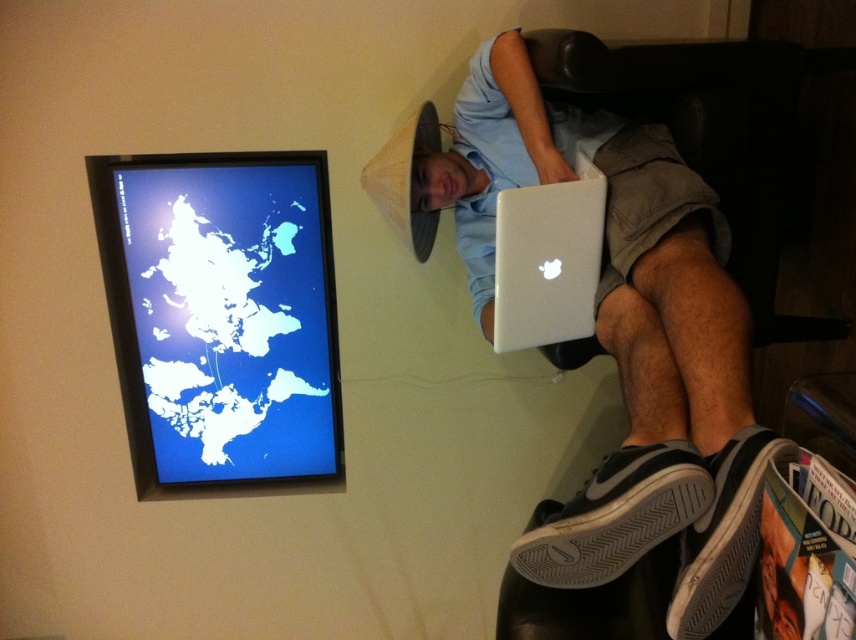
You are a delivery person who needs to place a package on the silver metallic laptop at upper center. However, the package is as big as the black mesh shoe at lower right. Can you place the package on the laptop without moving the laptop or the shoe?

The silver metallic laptop at upper center is positioned over the black mesh shoe at lower right, meaning the laptop is already above the shoe. Since the package is as big as the shoe, placing it on the laptop would require space not obstructed by the shoe. However, since the laptop is already above the shoe, there might not be enough space. But since the laptop is elevated, the package can be placed on the laptop as the shoe is below it.

You are standing in the room and want to reach the blue glossy map at upper left. If your arm can extend 1.8 meters, can you touch the map without moving your feet?

The blue glossy map at upper left is 2.15 meters away from the camera, which is beyond your arm extension of 1.8 meters. Therefore, you cannot touch it without moving your feet.

What are the coordinates of the silver metallic laptop at upper center?

The silver metallic laptop at upper center is located at point (625, 339).